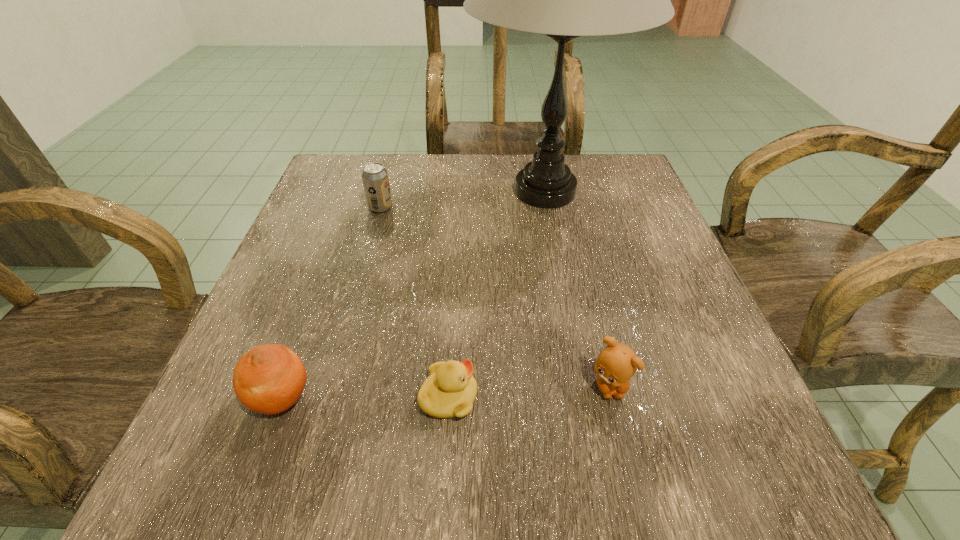
Locate an element on the screen. The image size is (960, 540). lamp located at the far edge is located at coordinates (564, 0).

Identify the location of beer can that is at the far edge. (375, 179).

Identify the location of beer can at the left edge. The height and width of the screenshot is (540, 960). (375, 179).

This screenshot has height=540, width=960. In order to click on orange that is at the left edge in this screenshot , I will do [x=268, y=379].

This screenshot has width=960, height=540. Identify the location of lamp at the right edge. coord(564,0).

This screenshot has height=540, width=960. Identify the location of teddy bear that is at the right edge. (616, 364).

Image resolution: width=960 pixels, height=540 pixels. In order to click on object that is at the far left corner in this screenshot , I will do coord(375,179).

At what (x,y) coordinates should I click in order to perform the action: click on object located in the far right corner section of the desktop. Please return your answer as a coordinate pair (x, y). This screenshot has height=540, width=960. Looking at the image, I should click on (564, 0).

This screenshot has height=540, width=960. I want to click on vacant space at the far edge of the desktop, so click(404, 163).

This screenshot has width=960, height=540. I want to click on vacant area at the left edge, so click(x=360, y=212).